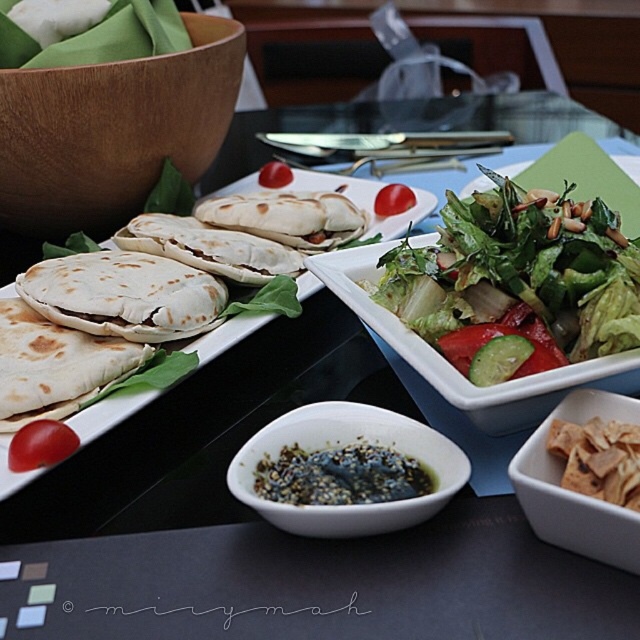
Is white soft pita bread at left positioned at the back of white soft tortilla at center?

That is False.

Where is `white soft pita bread at left`? The image size is (640, 640). white soft pita bread at left is located at coordinates (365, 198).

Consider the image. Measure the distance between wooden bowl at upper left and camera.

wooden bowl at upper left is 24.87 inches away from camera.

Looking at this image, between wooden bowl at upper left and brown crumbly snack at center, which one is positioned higher?

Positioned higher is wooden bowl at upper left.

Is point (35, 74) positioned in front of point (573, 448)?

No, (35, 74) is further to viewer.

The height and width of the screenshot is (640, 640). What are the coordinates of `wooden bowl at upper left` in the screenshot? It's located at tap(113, 129).

Is point (410, 467) farther from viewer compared to point (381, 198)?

No.

Locate an element on the screen. The image size is (640, 640). semi-liquid dark green at center is located at coordinates (340, 476).